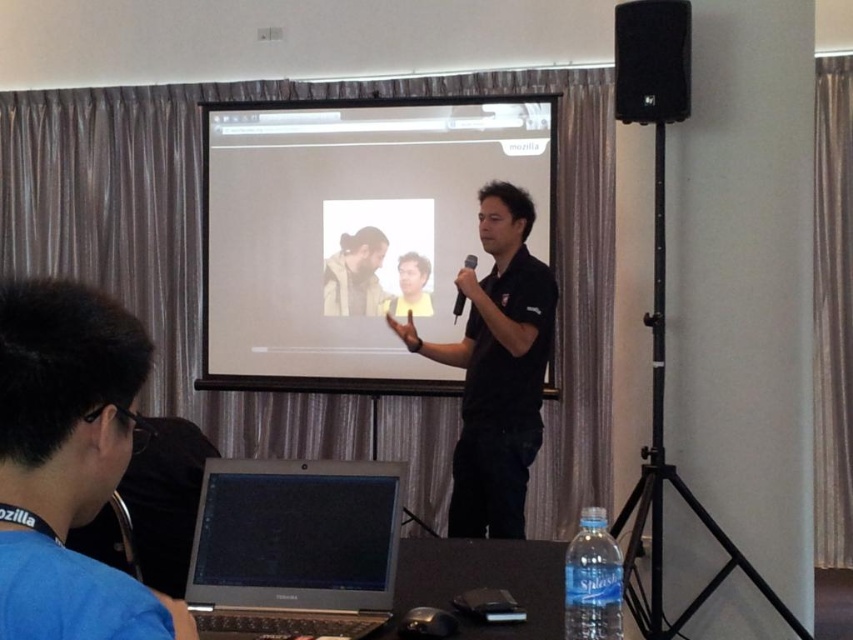
Question: Which point is farther to the camera?

Choices:
 (A) matte yellow shirt at center
 (B) brown suede jacket at center
 (C) black matte microphone at center

Answer: (B)

Question: Is matte white projector screen at center closer to camera compared to black matte microphone at center?

Choices:
 (A) no
 (B) yes

Answer: (A)

Question: Can you confirm if blue fabric shirt at lower left is positioned to the left of black matte speaker at upper right?

Choices:
 (A) yes
 (B) no

Answer: (A)

Question: Which point is closer to the camera taking this photo?

Choices:
 (A) (196, 595)
 (B) (328, 304)

Answer: (A)

Question: Which point is farther from the camera taking this photo?

Choices:
 (A) (305, 586)
 (B) (76, 474)
 (C) (459, 296)
 (D) (676, 118)

Answer: (C)

Question: Does matte white projector screen at center have a smaller size compared to black matte shirt at center?

Choices:
 (A) yes
 (B) no

Answer: (B)